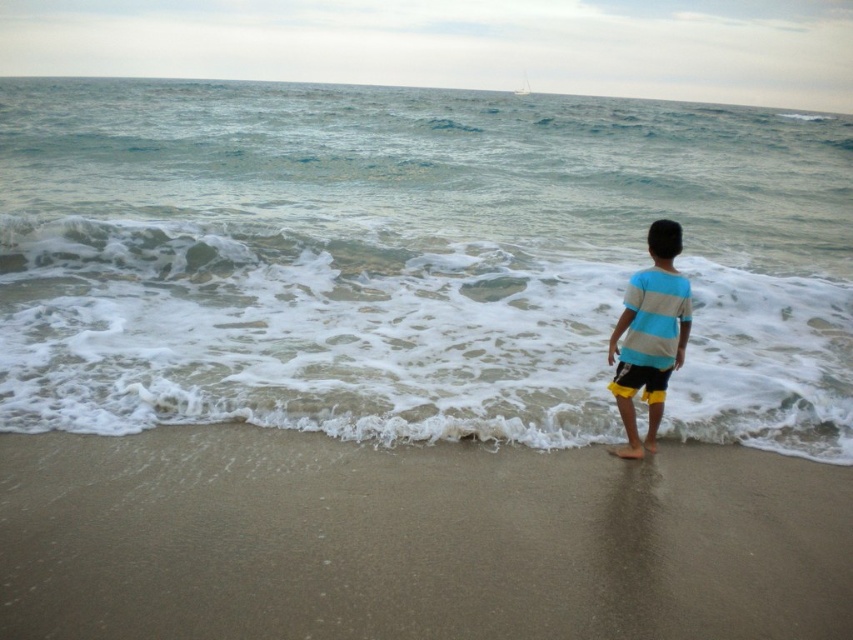
You are a photographer trying to capture the child in the scene. The striped cotton shirt at center and the yellow fabric shorts at lower right are both visible in the frame. Which piece of clothing should you focus on to ensure the subject is centered in your photo?

You should focus on the striped cotton shirt at center because it is wider than the yellow fabric shorts at lower right, making it a better central point for the composition.

You are a photographer trying to capture a photo of the striped cotton shirt at center and the clear blue water at center. Which object should you focus on first if you want to include both in your shot without moving the camera?

The clear blue water at center is bigger than the striped cotton shirt at center, so you should focus on the clear blue water at center first to ensure it fills the frame appropriately before adjusting for the smaller striped cotton shirt at center.